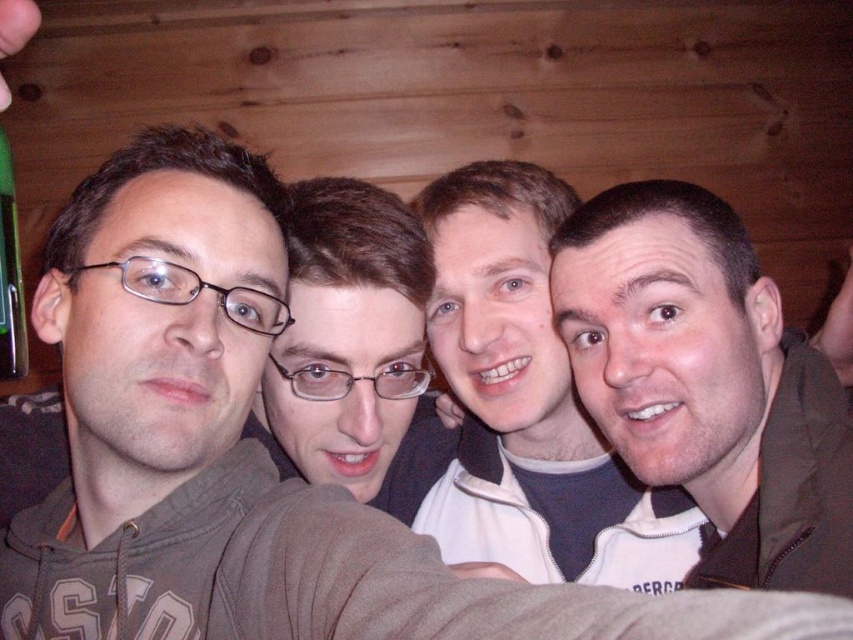
Question: Which of these objects is positioned closest to the green plastic bottle at left?

Choices:
 (A) matte black glasses at center
 (B) white fleece jacket at center
 (C) brown matte jacket at right

Answer: (A)

Question: Estimate the real-world distances between objects in this image. Which object is closer to the matte black glasses at center?

Choices:
 (A) green plastic bottle at left
 (B) white fleece jacket at center
 (C) brown matte jacket at right

Answer: (B)

Question: Can you confirm if white fleece jacket at center is thinner than green plastic bottle at left?

Choices:
 (A) no
 (B) yes

Answer: (A)

Question: Does white fleece jacket at center appear over green plastic bottle at left?

Choices:
 (A) yes
 (B) no

Answer: (B)

Question: Which object is the closest to the green plastic bottle at left?

Choices:
 (A) matte black glasses at center
 (B) brown matte jacket at right
 (C) white fleece jacket at center

Answer: (A)

Question: Is matte black glasses at center bigger than green plastic bottle at left?

Choices:
 (A) no
 (B) yes

Answer: (B)